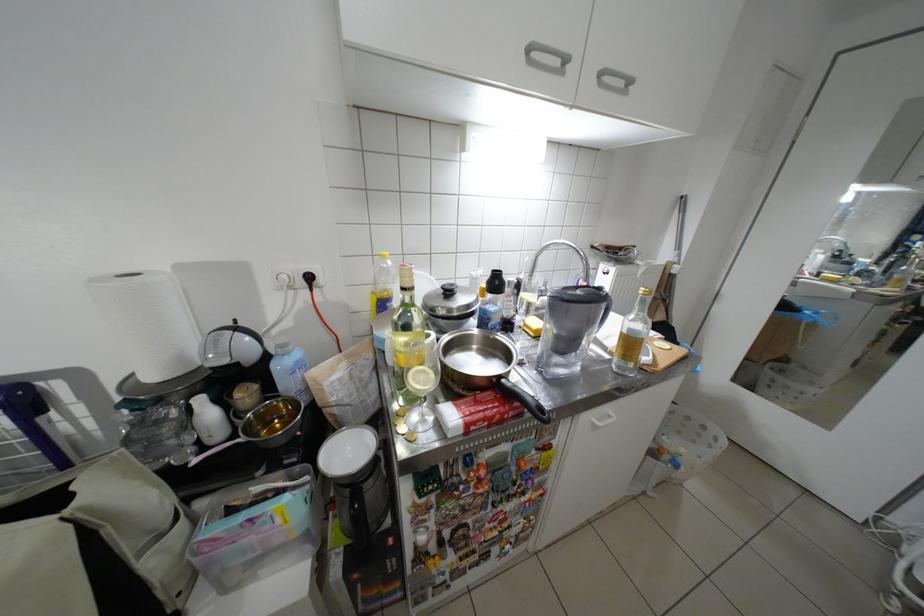
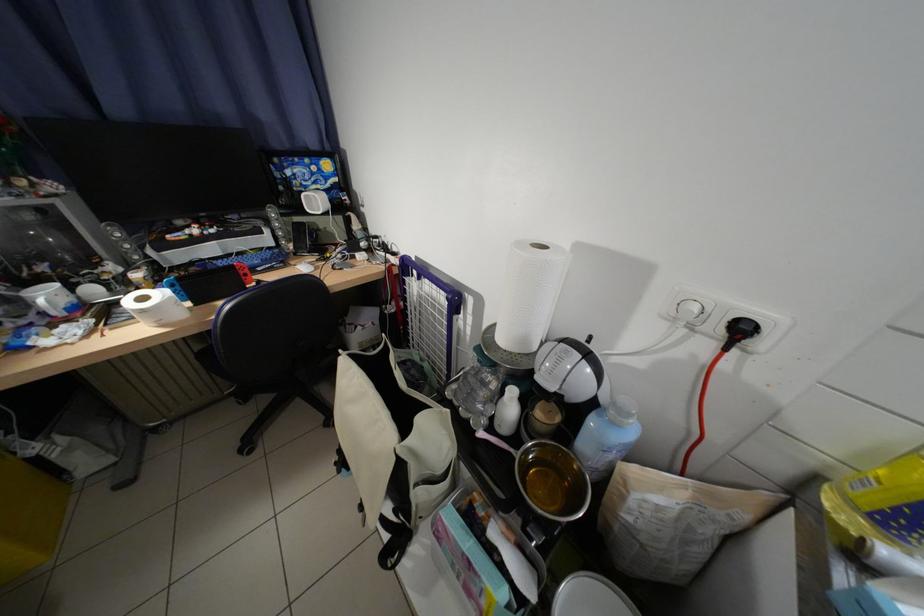
Locate, in the second image, the point that corresponds to (321,278) in the first image.

(754, 331)